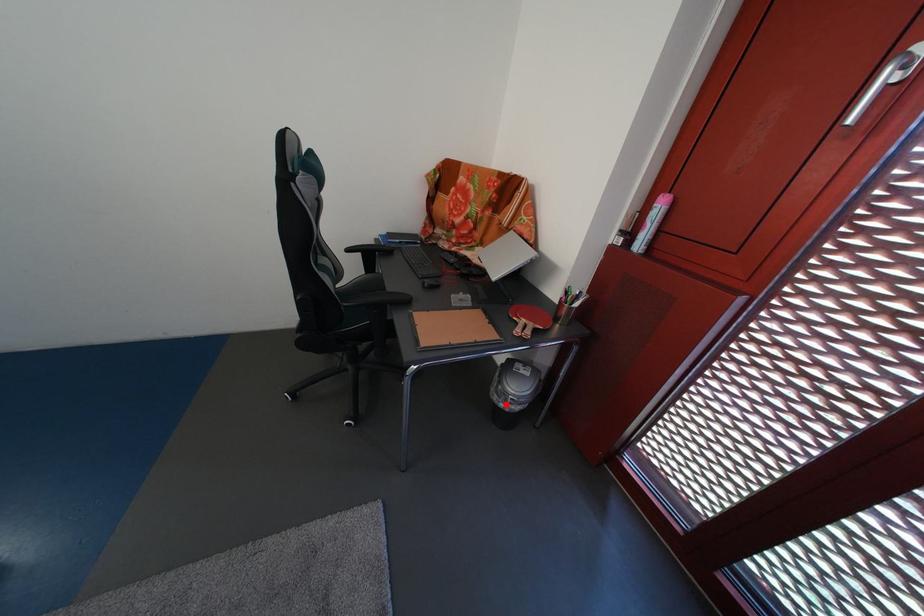
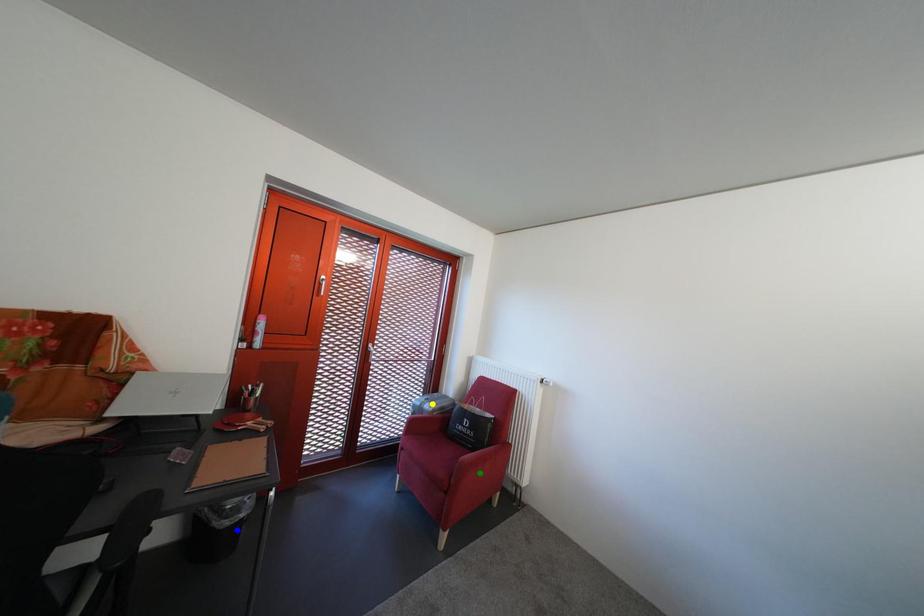
Question: I am providing you with two images of the same scene from different viewpoints. A red point is marked on the first image. You are given multiple points on the second image. Can you choose the point in image 2 that corresponds to the point in image 1?

Choices:
 (A) blue point
 (B) green point
 (C) yellow point

Answer: (A)